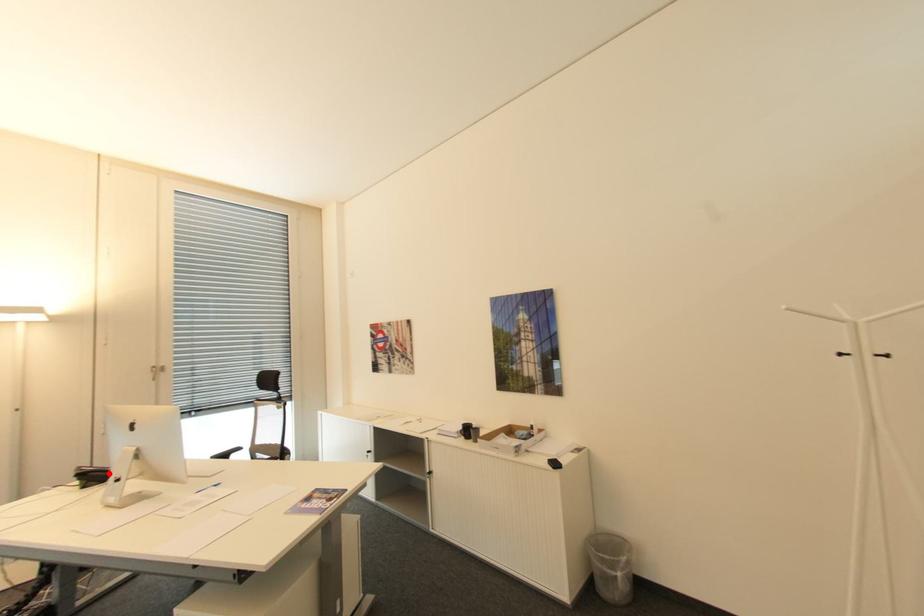
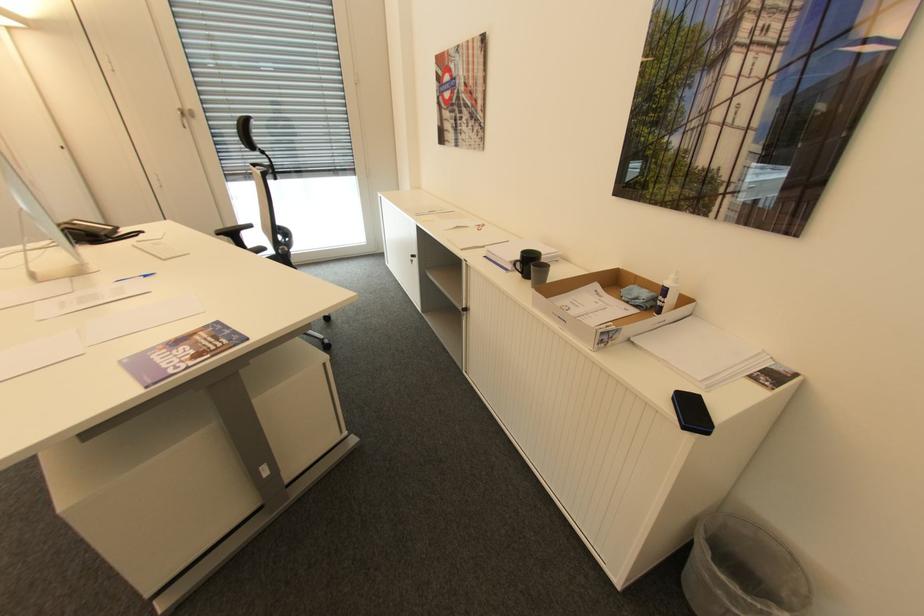
Locate, in the second image, the point that corresponds to the highlighted location in the first image.

(88, 233)